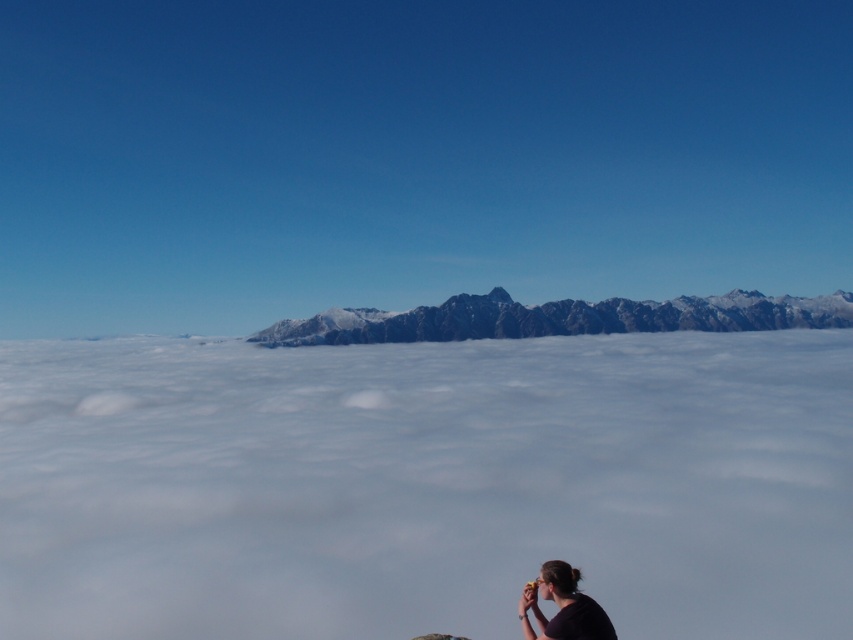
Question: Among these objects, which one is farthest from the camera?

Choices:
 (A) white fluffy cloud at center
 (B) snowy rocky mountains at center

Answer: (B)

Question: Is white fluffy cloud at center positioned before black matte shirt at lower right?

Choices:
 (A) yes
 (B) no

Answer: (B)

Question: Can you confirm if white fluffy cloud at center is positioned below snowy rocky mountains at center?

Choices:
 (A) no
 (B) yes

Answer: (B)

Question: Can you confirm if white fluffy cloud at center is positioned above snowy rocky mountains at center?

Choices:
 (A) no
 (B) yes

Answer: (A)

Question: Which point is closer to the camera?

Choices:
 (A) (672, 484)
 (B) (519, 618)
 (C) (560, 328)

Answer: (B)

Question: Which object is the farthest from the snowy rocky mountains at center?

Choices:
 (A) white fluffy cloud at center
 (B) black matte shirt at lower right

Answer: (B)